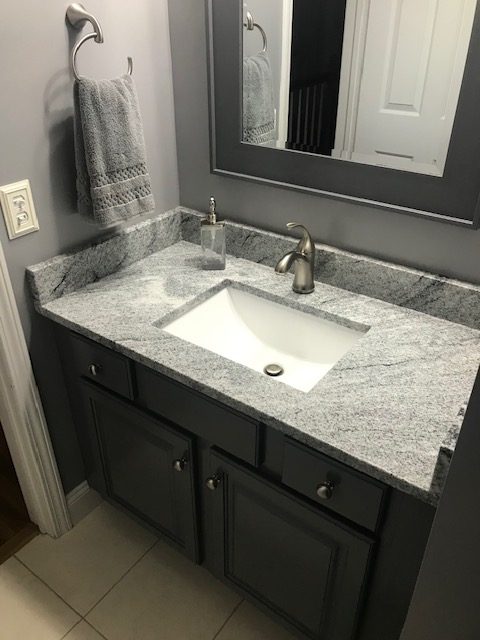
Locate an element on the screen. Image resolution: width=480 pixels, height=640 pixels. sink basin is located at coordinates (297, 349).